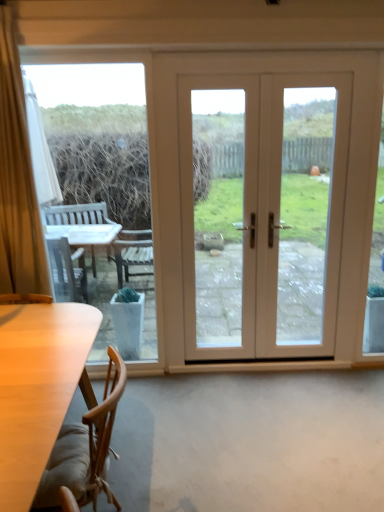
Where is `free spot above white glossy door at center (from a real-world perspective)`? This screenshot has height=512, width=384. free spot above white glossy door at center (from a real-world perspective) is located at coordinates coord(274,53).